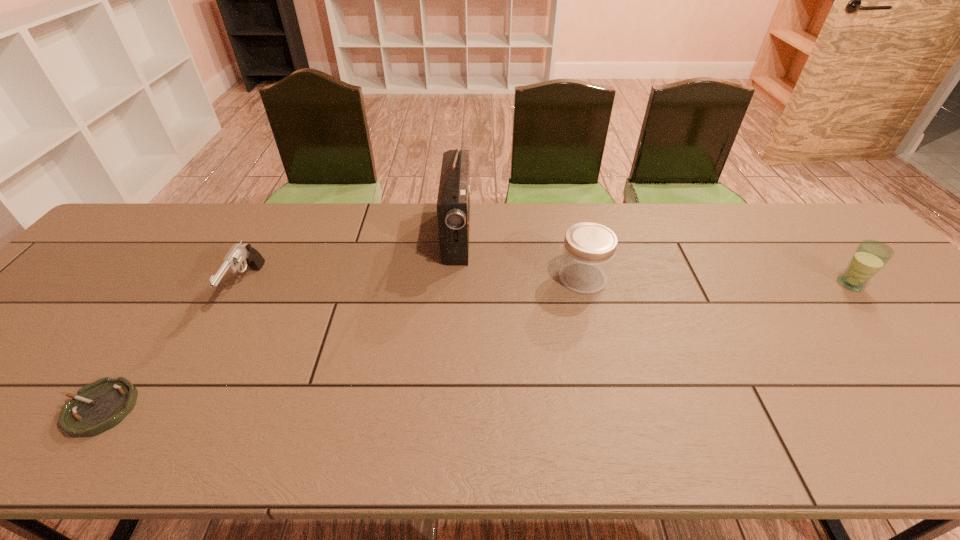
Identify the location of the closest object to the glass. (589, 248).

Select which object appears as the second closest to the radio receiver. Please provide its 2D coordinates. Your answer should be formatted as a tuple, i.e. [(x, y)], where the tuple contains the x and y coordinates of a point satisfying the conditions above.

[(239, 254)]

Where is `free space that satisfies the following two spatial constraints: 1. on the front-facing side of the radio receiver; 2. at the muzzle of the gun`? free space that satisfies the following two spatial constraints: 1. on the front-facing side of the radio receiver; 2. at the muzzle of the gun is located at coordinates (454, 287).

I want to click on free space in the image that satisfies the following two spatial constraints: 1. on the front-facing side of the tallest object; 2. on the back side of the rightmost object, so click(454, 284).

Find the location of a particular element. Image resolution: width=960 pixels, height=540 pixels. vacant space that satisfies the following two spatial constraints: 1. on the back side of the leftmost object; 2. on the left side of the fourth object from left to right is located at coordinates (192, 278).

This screenshot has height=540, width=960. Find the location of `free space that satisfies the following two spatial constraints: 1. on the front-facing side of the tallest object; 2. on the left side of the jar`. free space that satisfies the following two spatial constraints: 1. on the front-facing side of the tallest object; 2. on the left side of the jar is located at coordinates (454, 278).

Find the location of `free space that satisfies the following two spatial constraints: 1. on the front-facing side of the third object from right to left; 2. on the front side of the shortest object`. free space that satisfies the following two spatial constraints: 1. on the front-facing side of the third object from right to left; 2. on the front side of the shortest object is located at coordinates (446, 408).

The image size is (960, 540). What are the coordinates of `free space that satisfies the following two spatial constraints: 1. on the back side of the nearest object; 2. on the right side of the glass` in the screenshot? It's located at pos(187,284).

I want to click on free location that satisfies the following two spatial constraints: 1. on the front-facing side of the tallest object; 2. on the back side of the fourth object from left to right, so click(x=454, y=278).

You are a GUI agent. You are given a task and a screenshot of the screen. Output one action in this format:
    pyautogui.click(x=<x>, y=<y>)
    Task: Click on the vacant area that satisfies the following two spatial constraints: 1. on the front-facing side of the radio receiver; 2. on the right side of the jar
    The image size is (960, 540).
    Given the screenshot: What is the action you would take?
    pyautogui.click(x=454, y=278)